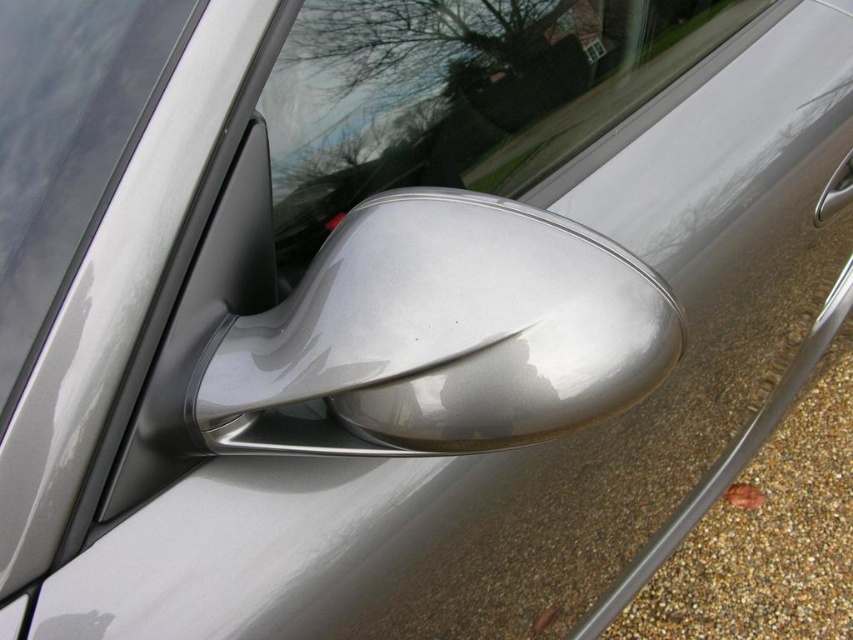
Is glossy metallic car window at center to the left of polished silver door handle at lower right from the viewer's perspective?

Yes, glossy metallic car window at center is to the left of polished silver door handle at lower right.

Can you confirm if glossy metallic car window at center is shorter than polished silver door handle at lower right?

No.

Which is in front, point (544, 36) or point (817, 198)?

Point (544, 36)

I want to click on glossy metallic car window at center, so click(473, 99).

Can you confirm if satin silver mirror at center is bigger than transparent glass window at center?

Yes, satin silver mirror at center is bigger than transparent glass window at center.

Does point (572, 326) come in front of point (585, 38)?

That is True.

The height and width of the screenshot is (640, 853). What are the coordinates of `satin silver mirror at center` in the screenshot? It's located at (440, 336).

Does satin silver mirror at center have a lesser height compared to polished silver door handle at lower right?

No.

Is point (552, 257) farther from viewer compared to point (820, 198)?

No, (552, 257) is in front of (820, 198).

Between point (403, 305) and point (843, 205), which one is positioned in front?

Point (403, 305)

Where is `satin silver mirror at center`? The width and height of the screenshot is (853, 640). satin silver mirror at center is located at coordinates (440, 336).